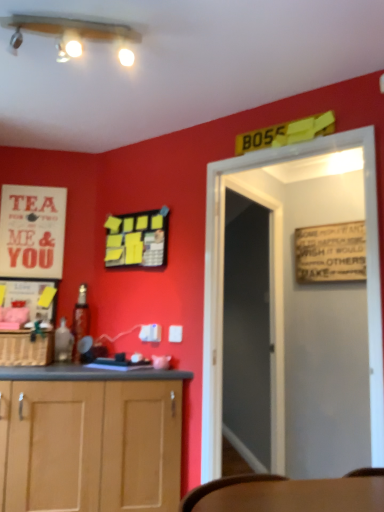
Question: Considering the positions of point (76, 352) and point (41, 214), is point (76, 352) closer or farther from the camera than point (41, 214)?

Choices:
 (A) closer
 (B) farther

Answer: (A)

Question: Considering the positions of metallic glass bottle at left, which is the first bottle from back to front, and white paper poster at upper left in the image, is metallic glass bottle at left, which is the first bottle from back to front, wider or thinner than white paper poster at upper left?

Choices:
 (A) thin
 (B) wide

Answer: (B)

Question: Which object is the closest to the translucent glass bottle at lower left, which is the second bottle from back to front?

Choices:
 (A) white paper poster at upper left
 (B) matte white lights at upper center
 (C) metallic glass bottle at left, which is the first bottle from back to front
 (D) transparent glass door at center
 (E) woven brown basket at lower left

Answer: (C)

Question: Based on their relative distances, which object is farther from the metallic glass bottle at left, acting as the 2th bottle starting from the front?

Choices:
 (A) woven brown basket at lower left
 (B) translucent glass bottle at lower left, which is the second bottle from back to front
 (C) white wooden door at center
 (D) matte white lights at upper center
 (E) white paper poster at upper left

Answer: (D)